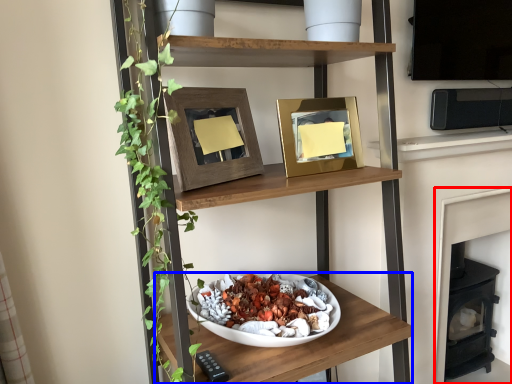
Question: Which object is closer to the camera taking this photo, fireplace (highlighted by a red box) or shelf (highlighted by a blue box)?

Choices:
 (A) fireplace
 (B) shelf

Answer: (B)